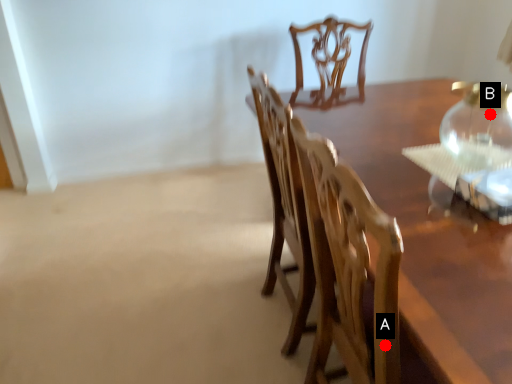
Question: Two points are circled on the image, labeled by A and B beside each circle. Among these points, which one is farthest from the camera?

Choices:
 (A) A is further
 (B) B is further

Answer: (B)